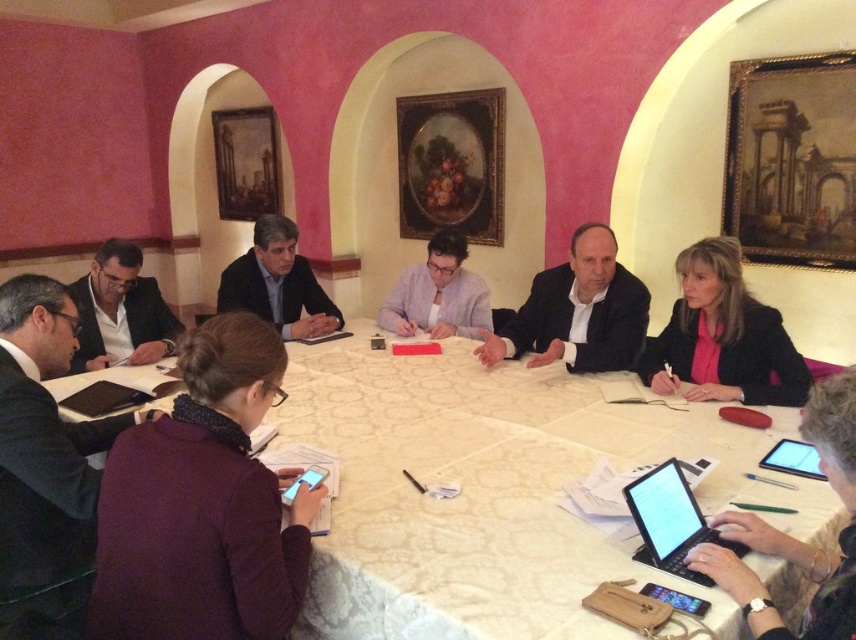
Who is higher up, purple sweater at lower left or black plastic laptop at lower right?

purple sweater at lower left

Does purple sweater at lower left have a greater width compared to black plastic laptop at lower right?

Yes, purple sweater at lower left is wider than black plastic laptop at lower right.

You are a GUI agent. You are given a task and a screenshot of the screen. Output one action in this format:
    pyautogui.click(x=<x>, y=<y>)
    Task: Click on the purple sweater at lower left
    
    Given the screenshot: What is the action you would take?
    pyautogui.click(x=203, y=504)

Who is shorter, black suit at lower left or dark gray suit at center?

Standing shorter between the two is dark gray suit at center.

Does black suit at lower left appear over dark gray suit at center?

No, black suit at lower left is not above dark gray suit at center.

Identify the location of black suit at lower left. (45, 467).

Which of these two, black suit at lower left or pink matte blazer at lower right, stands shorter?

pink matte blazer at lower right

Describe the element at coordinates (45, 467) in the screenshot. I see `black suit at lower left` at that location.

Locate an element on the screen. This screenshot has width=856, height=640. black suit at lower left is located at coordinates (45, 467).